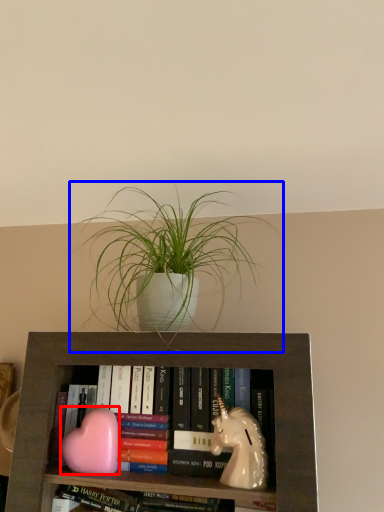
Question: Which object is further to the camera taking this photo, animal (highlighted by a red box) or houseplant (highlighted by a blue box)?

Choices:
 (A) animal
 (B) houseplant

Answer: (A)